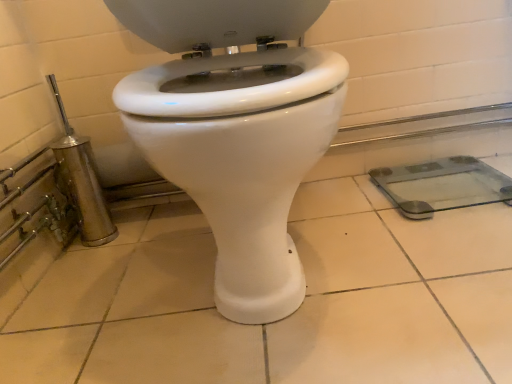
At what (x,y) coordinates should I click in order to perform the action: click on transparent glass scale at right. Please return your answer as a coordinate pair (x, y). This screenshot has height=384, width=512. Looking at the image, I should click on (442, 186).

Measure the distance between transparent glass scale at right and camera.

The depth of transparent glass scale at right is 3.28 feet.

The image size is (512, 384). Describe the element at coordinates (442, 186) in the screenshot. I see `transparent glass scale at right` at that location.

Locate an element on the screen. transparent glass scale at right is located at coordinates (442, 186).